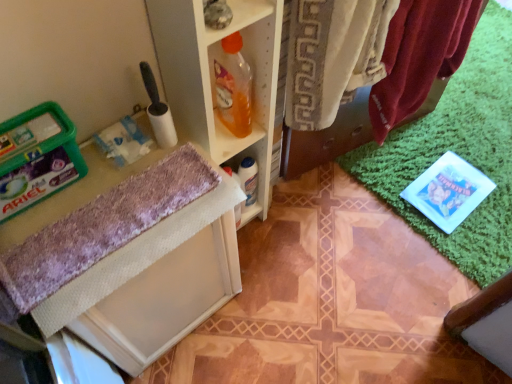
Question: From the image's perspective, is purple fuzzy bath towel at lower left located above or below velvet-like red towel at upper right?

Choices:
 (A) above
 (B) below

Answer: (B)

Question: In the image, is purple fuzzy bath towel at lower left positioned in front of or behind velvet-like red towel at upper right?

Choices:
 (A) behind
 (B) front

Answer: (B)

Question: Which is farther from the translucent orange liquid at shelf center?

Choices:
 (A) purple fuzzy bath towel at lower left
 (B) velvet-like red towel at upper right

Answer: (B)

Question: Which object is the closest to the translucent orange liquid at shelf center?

Choices:
 (A) velvet-like red towel at upper right
 (B) purple fuzzy bath towel at lower left

Answer: (B)